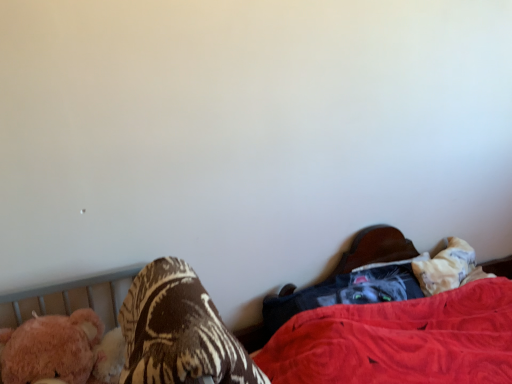
Question: From the image's perspective, is dark gray fabric at lower right under fuzzy pink teddy bear at left?

Choices:
 (A) no
 (B) yes

Answer: (A)

Question: Is dark gray fabric at lower right not inside fuzzy pink teddy bear at left?

Choices:
 (A) yes
 (B) no

Answer: (A)

Question: Is dark gray fabric at lower right taller than fuzzy pink teddy bear at left?

Choices:
 (A) yes
 (B) no

Answer: (B)

Question: Is dark gray fabric at lower right thinner than fuzzy pink teddy bear at left?

Choices:
 (A) no
 (B) yes

Answer: (B)

Question: Can fuzzy pink teddy bear at left be found inside dark gray fabric at lower right?

Choices:
 (A) yes
 (B) no

Answer: (B)

Question: Visually, is brown textured blanket at lower left positioned to the left or to the right of velvet black cat at lower right?

Choices:
 (A) left
 (B) right

Answer: (A)

Question: From a real-world perspective, is brown textured blanket at lower left above or below velvet black cat at lower right?

Choices:
 (A) below
 (B) above

Answer: (B)

Question: From the image's perspective, is brown textured blanket at lower left above or below velvet black cat at lower right?

Choices:
 (A) below
 (B) above

Answer: (B)

Question: Considering their positions, is brown textured blanket at lower left located in front of or behind velvet black cat at lower right?

Choices:
 (A) behind
 (B) front

Answer: (B)

Question: Relative to brown textured blanket at lower left, is fuzzy pink teddy bear at left in front or behind?

Choices:
 (A) front
 (B) behind

Answer: (B)

Question: Based on their sizes in the image, would you say fuzzy pink teddy bear at left is bigger or smaller than brown textured blanket at lower left?

Choices:
 (A) big
 (B) small

Answer: (B)

Question: Based on their positions, is fuzzy pink teddy bear at left located to the left or right of brown textured blanket at lower left?

Choices:
 (A) left
 (B) right

Answer: (A)

Question: From a real-world perspective, is fuzzy pink teddy bear at left positioned above or below brown textured blanket at lower left?

Choices:
 (A) below
 (B) above

Answer: (A)

Question: From the image's perspective, is fuzzy pink teddy bear at left located above or below dark gray fabric at lower right?

Choices:
 (A) above
 (B) below

Answer: (B)

Question: From a real-world perspective, is fuzzy pink teddy bear at left positioned above or below dark gray fabric at lower right?

Choices:
 (A) above
 (B) below

Answer: (B)